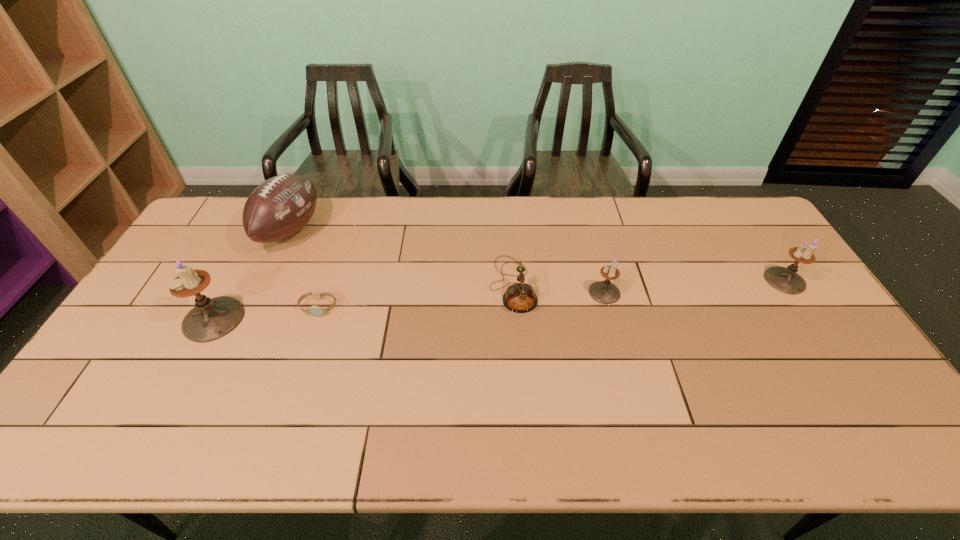
You are a GUI agent. You are given a task and a screenshot of the screen. Output one action in this format:
    pyautogui.click(x=<x>, y=<y>)
    Task: Click on the empty space between the football (American) and the fifth object from left to right
    
    Given the screenshot: What is the action you would take?
    pyautogui.click(x=447, y=261)

Where is `vacant region between the leftmost candle holder and the rightmost object`? vacant region between the leftmost candle holder and the rightmost object is located at coordinates (499, 300).

At what (x,y) coordinates should I click in order to perform the action: click on unoccupied area between the tallest candle holder and the watch. Please return your answer as a coordinate pair (x, y). Image resolution: width=960 pixels, height=540 pixels. Looking at the image, I should click on (266, 313).

You are a GUI agent. You are given a task and a screenshot of the screen. Output one action in this format:
    pyautogui.click(x=<x>, y=<y>)
    Task: Click on the unoccupied position between the rightmost candle holder and the football (American)
    This screenshot has width=960, height=540.
    Given the screenshot: What is the action you would take?
    pyautogui.click(x=538, y=255)

Locate an element on the screen. unoccupied position between the third object from right to left and the rightmost candle holder is located at coordinates (649, 282).

Where is `object that is the fifth nearest to the third object from left to right`? The height and width of the screenshot is (540, 960). object that is the fifth nearest to the third object from left to right is located at coordinates (786, 280).

This screenshot has width=960, height=540. I want to click on the fifth closest object to the second tallest candle holder, so click(x=210, y=319).

Identify which candle holder is the third closest to the third object from right to left. Please provide its 2D coordinates. Your answer should be formatted as a tuple, i.e. [(x, y)], where the tuple contains the x and y coordinates of a point satisfying the conditions above.

[(786, 280)]

The image size is (960, 540). Identify the location of candle holder that stands as the second closest to the watch. (605, 292).

Identify the location of vacant space that satisfies the following two spatial constraints: 1. on the rotary dial of the telephone; 2. on the face of the shortest object. (515, 307).